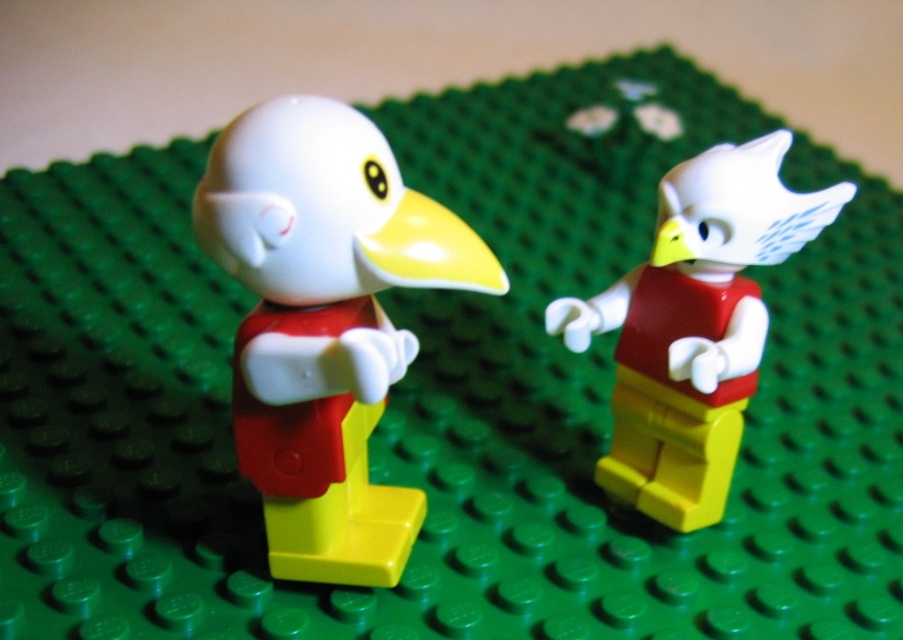
In the scene shown: Is matte plastic bird at center further to the viewer compared to matte red torso at center?

No, matte plastic bird at center is in front of matte red torso at center.

Is matte plastic bird at center to the left of matte red torso at center from the viewer's perspective?

Indeed, matte plastic bird at center is positioned on the left side of matte red torso at center.

Who is more forward, (306, 572) or (613, 429)?

Positioned in front is point (306, 572).

Find the location of a particular element. matte plastic bird at center is located at coordinates (324, 323).